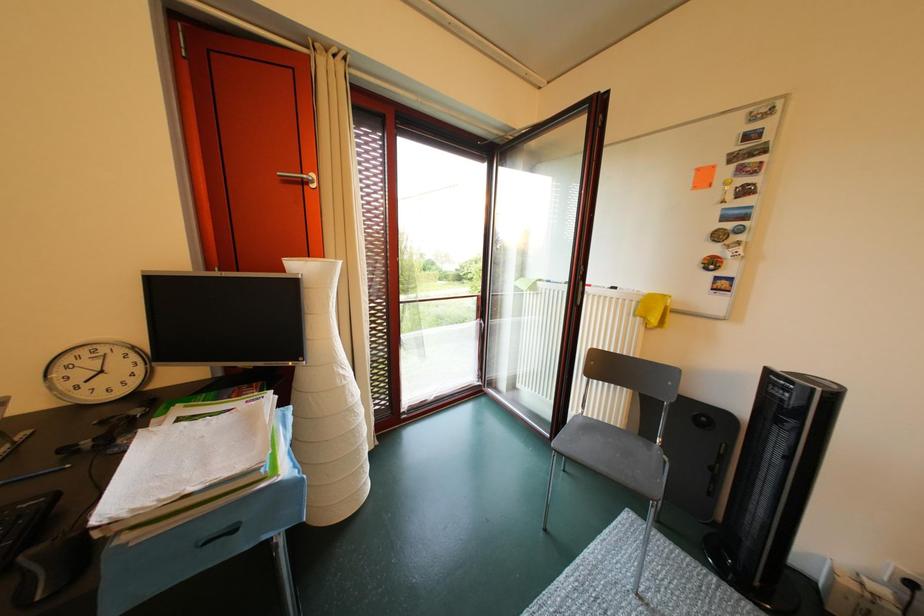
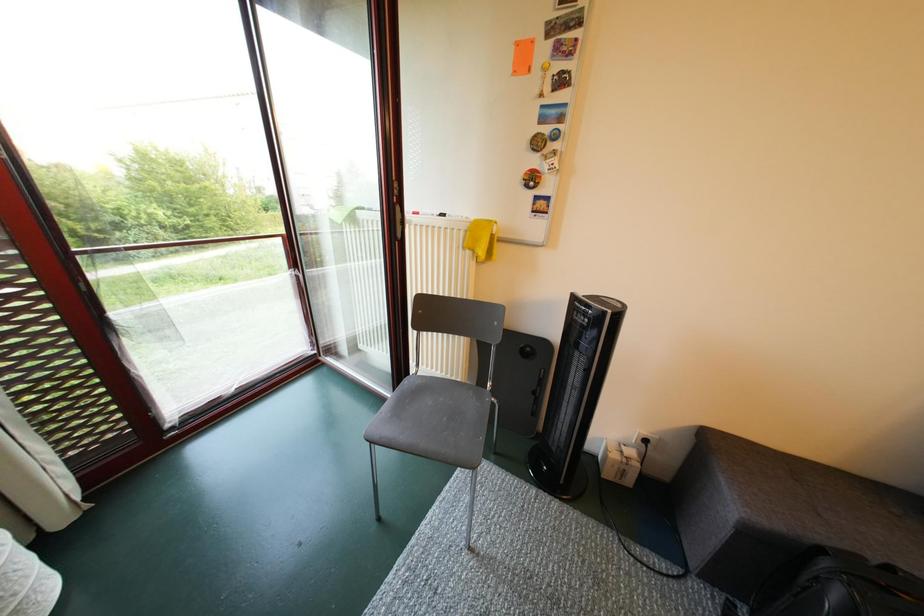
Question: The camera is either moving clockwise (left) or counter-clockwise (right) around the object. The first image is from the beginning of the video and the second image is from the end. Is the camera moving left or right when shooting the video?

Choices:
 (A) Left
 (B) Right

Answer: (A)